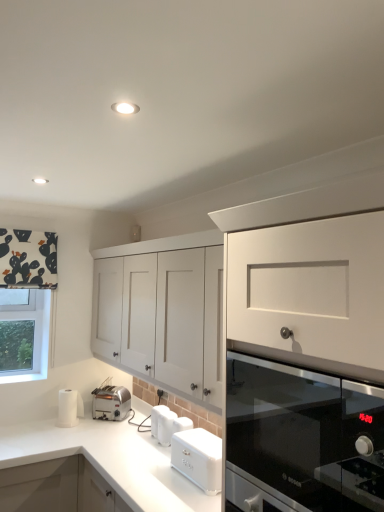
The width and height of the screenshot is (384, 512). Find the location of `silver metallic toaster at lower left, which is the first kitchen appliance from left to right`. silver metallic toaster at lower left, which is the first kitchen appliance from left to right is located at coordinates (111, 402).

Locate an element on the screen. The width and height of the screenshot is (384, 512). black printed fabric at upper left is located at coordinates (28, 259).

What do you see at coordinates (34, 339) in the screenshot?
I see `clear glass window at left` at bounding box center [34, 339].

Where is `white matte cabinet at center`? white matte cabinet at center is located at coordinates tap(163, 311).

Locate an element on the screen. The image size is (384, 512). silver metallic toaster at lower left, arranged as the first kitchen appliance when viewed from the back is located at coordinates (111, 402).

Locate an element on the screen. cabinetry located below the black printed fabric at upper left (from the image's perspective) is located at coordinates click(163, 311).

Considering the sizes of objects white matte cabinet at center and black printed fabric at upper left in the image provided, who is bigger, white matte cabinet at center or black printed fabric at upper left?

With larger size is white matte cabinet at center.

Considering their positions, is white matte cabinet at center located in front of or behind black printed fabric at upper left?

white matte cabinet at center is in front of black printed fabric at upper left.

Between white matte cabinet at center and black printed fabric at upper left, which one has larger width?

white matte cabinet at center is wider.

Based on their sizes in the image, would you say black printed fabric at upper left is bigger or smaller than silver metallic toaster at lower left, which is the first kitchen appliance from left to right?

Considering their sizes, black printed fabric at upper left takes up more space than silver metallic toaster at lower left, which is the first kitchen appliance from left to right.

Does black printed fabric at upper left turn towards silver metallic toaster at lower left, which is counted as the second kitchen appliance, starting from the right?

No, black printed fabric at upper left is not facing towards silver metallic toaster at lower left, which is counted as the second kitchen appliance, starting from the right.

From the image's perspective, between black printed fabric at upper left and silver metallic toaster at lower left, which is counted as the second kitchen appliance, starting from the right, which one is located above?

black printed fabric at upper left.

How far apart are black printed fabric at upper left and silver metallic toaster at lower left, which is counted as the second kitchen appliance, starting from the right?

3.55 feet.

From a real-world perspective, is clear glass window at left positioned above or below black printed fabric at upper left?

From a real-world perspective, clear glass window at left is physically below black printed fabric at upper left.

Is clear glass window at left wider than black printed fabric at upper left?

Yes, clear glass window at left is wider than black printed fabric at upper left.

From their relative heights in the image, would you say clear glass window at left is taller or shorter than black printed fabric at upper left?

Clearly, clear glass window at left is taller compared to black printed fabric at upper left.

Considering the points (24, 312) and (23, 241), which point is in front, point (24, 312) or point (23, 241)?

The point (23, 241) is closer to the camera.

What's the angular difference between black glass oven at right and white matte bread bin at lower center, the second kitchen appliance viewed from the left,'s facing directions?

There is a 2.9-degree angle between the facing directions of black glass oven at right and white matte bread bin at lower center, the second kitchen appliance viewed from the left.

Does black glass oven at right appear on the left side of white matte bread bin at lower center, which is counted as the 1th kitchen appliance, starting from the front?

No, black glass oven at right is not to the left of white matte bread bin at lower center, which is counted as the 1th kitchen appliance, starting from the front.

From a real-world perspective, is black glass oven at right under white matte bread bin at lower center, which is counted as the 1th kitchen appliance, starting from the front?

Incorrect, from a real-world perspective, black glass oven at right is higher than white matte bread bin at lower center, which is counted as the 1th kitchen appliance, starting from the front.

The width and height of the screenshot is (384, 512). There is a black glass oven at right. In order to click on the 2nd kitchen appliance below it (from a real-world perspective) in this screenshot , I will do `click(198, 458)`.

Which is more to the right, white matte bread bin at lower center, the second kitchen appliance viewed from the left, or white matte cabinet at center?

white matte bread bin at lower center, the second kitchen appliance viewed from the left.

Based on the photo, considering the relative sizes of white matte bread bin at lower center, which is counted as the 1th kitchen appliance, starting from the front, and white matte cabinet at center in the image provided, is white matte bread bin at lower center, which is counted as the 1th kitchen appliance, starting from the front, shorter than white matte cabinet at center?

Yes, white matte bread bin at lower center, which is counted as the 1th kitchen appliance, starting from the front, is shorter than white matte cabinet at center.

Would you say white matte bread bin at lower center, the second kitchen appliance viewed from the left, is inside or outside white matte cabinet at center?

white matte bread bin at lower center, the second kitchen appliance viewed from the left, is located beyond the bounds of white matte cabinet at center.

Which of these two, white matte bread bin at lower center, the second kitchen appliance viewed from the left, or white matte cabinet at center, is thinner?

white matte bread bin at lower center, the second kitchen appliance viewed from the left, is thinner.

Between silver metallic toaster at lower left, arranged as the first kitchen appliance when viewed from the back, and clear glass window at left, which one is positioned in front?

silver metallic toaster at lower left, arranged as the first kitchen appliance when viewed from the back, is in front.

Is silver metallic toaster at lower left, which is counted as the second kitchen appliance, starting from the right, in contact with clear glass window at left?

No, silver metallic toaster at lower left, which is counted as the second kitchen appliance, starting from the right, is not beside clear glass window at left.

From a real-world perspective, does silver metallic toaster at lower left, arranged as the first kitchen appliance when viewed from the back, sit lower than clear glass window at left?

Yes, from a real-world perspective, silver metallic toaster at lower left, arranged as the first kitchen appliance when viewed from the back, is beneath clear glass window at left.

Is silver metallic toaster at lower left, arranged as the first kitchen appliance when viewed from the back, facing away from clear glass window at left?

silver metallic toaster at lower left, arranged as the first kitchen appliance when viewed from the back, is not turned away from clear glass window at left.

From a real-world perspective, which is physically below, black printed fabric at upper left or white matte cabinet at center?

In real-world perspective, white matte cabinet at center is lower.

Find the location of a particular element. curtain that is above the white matte cabinet at center (from the image's perspective) is located at coordinates [28, 259].

Which of these two, black printed fabric at upper left or white matte cabinet at center, is bigger?

white matte cabinet at center.

In the scene shown: Does black printed fabric at upper left have a greater height compared to white matte cabinet at center?

No.

Where is `cabinetry below the black printed fabric at upper left (from the image's perspective)`? The height and width of the screenshot is (512, 384). cabinetry below the black printed fabric at upper left (from the image's perspective) is located at coordinates (163, 311).

The image size is (384, 512). What are the coordinates of `curtain located on the left of silver metallic toaster at lower left, which is counted as the second kitchen appliance, starting from the right` in the screenshot? It's located at (28, 259).

Estimate the real-world distances between objects in this image. Which object is closer to white matte cabinet at center, clear glass window at left or white matte bread bin at lower center, the first kitchen appliance when ordered from right to left?

white matte bread bin at lower center, the first kitchen appliance when ordered from right to left, lies closer to white matte cabinet at center than the other object.

Which object lies nearer to the anchor point black glass oven at right, black printed fabric at upper left or white plastic toaster at lower center?

Among the two, white plastic toaster at lower center is located nearer to black glass oven at right.

From the image, which object appears to be farther from white matte cabinet at center, white matte bread bin at lower center, the second kitchen appliance viewed from the left, or clear glass window at left?

clear glass window at left lies further to white matte cabinet at center than the other object.

Based on their spatial positions, is white plastic toaster at lower center or black glass oven at right closer to black printed fabric at upper left?

white plastic toaster at lower center is closer to black printed fabric at upper left.

Estimate the real-world distances between objects in this image. Which object is further from white matte bread bin at lower center, which is counted as the 1th kitchen appliance, starting from the front, black glass oven at right or black printed fabric at upper left?

Among the two, black printed fabric at upper left is located further to white matte bread bin at lower center, which is counted as the 1th kitchen appliance, starting from the front.

When comparing their distances from black glass oven at right, does white matte bread bin at lower center, the first kitchen appliance when ordered from right to left, or white plastic toaster at lower center seem further?

white plastic toaster at lower center is positioned further to the anchor black glass oven at right.

Considering their positions, is silver metallic toaster at lower left, which is counted as the second kitchen appliance, starting from the right, positioned closer to white matte cabinet at center than white matte bread bin at lower center, the first kitchen appliance when ordered from right to left?

white matte bread bin at lower center, the first kitchen appliance when ordered from right to left.

Which object lies nearer to the anchor point black glass oven at right, silver metallic toaster at lower left, arranged as the first kitchen appliance when viewed from the back, or white matte bread bin at lower center, which is counted as the 1th kitchen appliance, starting from the front?

Based on the image, white matte bread bin at lower center, which is counted as the 1th kitchen appliance, starting from the front, appears to be nearer to black glass oven at right.

What are the coordinates of `appliance between black glass oven at right and clear glass window at left along the z-axis` in the screenshot? It's located at (162, 424).

Image resolution: width=384 pixels, height=512 pixels. I want to click on window that lies between black printed fabric at upper left and silver metallic toaster at lower left, which is counted as the second kitchen appliance, starting from the right, from top to bottom, so click(x=34, y=339).

Where is `curtain located between white matte cabinet at center and clear glass window at left in the depth direction`? The image size is (384, 512). curtain located between white matte cabinet at center and clear glass window at left in the depth direction is located at coordinates (28, 259).

Where is `appliance positioned between white matte cabinet at center and black printed fabric at upper left from near to far`? This screenshot has height=512, width=384. appliance positioned between white matte cabinet at center and black printed fabric at upper left from near to far is located at coordinates (162, 424).